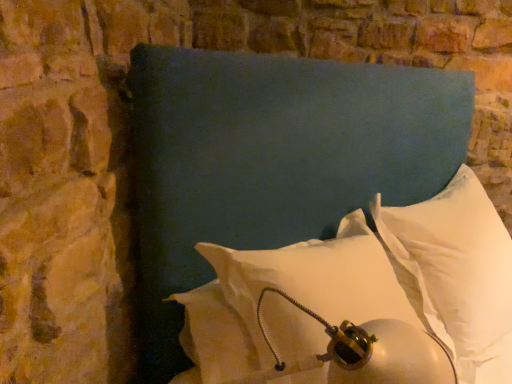
Question: Is the surface of white soft pillow at center, arranged as the 3th pillow when viewed from the left, in direct contact with white soft pillow at center, arranged as the 2th pillow when viewed from the left?

Choices:
 (A) yes
 (B) no

Answer: (B)

Question: Considering the relative positions of white soft pillow at center, arranged as the 3th pillow when viewed from the left, and white soft pillow at center, the second pillow from the right, in the image provided, is white soft pillow at center, arranged as the 3th pillow when viewed from the left, to the right of white soft pillow at center, the second pillow from the right, from the viewer's perspective?

Choices:
 (A) no
 (B) yes

Answer: (B)

Question: Considering the relative sizes of white soft pillow at center, arranged as the 3th pillow when viewed from the left, and white soft pillow at center, the second pillow from the right, in the image provided, is white soft pillow at center, arranged as the 3th pillow when viewed from the left, wider than white soft pillow at center, the second pillow from the right,?

Choices:
 (A) no
 (B) yes

Answer: (A)

Question: From a real-world perspective, is white soft pillow at center, arranged as the 3th pillow when viewed from the left, positioned over white soft pillow at center, arranged as the 2th pillow when viewed from the left, based on gravity?

Choices:
 (A) no
 (B) yes

Answer: (A)

Question: Is white soft pillow at center, arranged as the 3th pillow when viewed from the left, closer to camera compared to white soft pillow at center, the second pillow from the right?

Choices:
 (A) yes
 (B) no

Answer: (B)

Question: Is white soft pillow at center, which is the 1th pillow in right-to-left order, taller or shorter than white soft pillow at lower right, the 3th pillow from the right?

Choices:
 (A) short
 (B) tall

Answer: (A)

Question: From a real-world perspective, is white soft pillow at center, which is the 1th pillow in right-to-left order, positioned above or below white soft pillow at lower right, the 3th pillow from the right?

Choices:
 (A) below
 (B) above

Answer: (B)

Question: Looking at the image, does white soft pillow at center, arranged as the 3th pillow when viewed from the left, seem bigger or smaller compared to white soft pillow at lower right, placed as the first pillow when sorted from left to right?

Choices:
 (A) small
 (B) big

Answer: (A)

Question: From the image's perspective, relative to white soft pillow at lower right, the 3th pillow from the right, is white soft pillow at center, which is the 1th pillow in right-to-left order, above or below?

Choices:
 (A) above
 (B) below

Answer: (A)

Question: From the image's perspective, is white soft pillow at center, the second pillow from the right, located above or below white soft pillow at center, arranged as the 3th pillow when viewed from the left?

Choices:
 (A) above
 (B) below

Answer: (B)

Question: Is white soft pillow at center, the second pillow from the right, wider or thinner than white soft pillow at center, which is the 1th pillow in right-to-left order?

Choices:
 (A) thin
 (B) wide

Answer: (B)

Question: Is white soft pillow at center, the second pillow from the right, inside the boundaries of white soft pillow at center, arranged as the 3th pillow when viewed from the left, or outside?

Choices:
 (A) outside
 (B) inside

Answer: (A)

Question: Considering the relative positions of white soft pillow at center, the second pillow from the right, and white soft pillow at center, which is the 1th pillow in right-to-left order, in the image provided, is white soft pillow at center, the second pillow from the right, to the left or to the right of white soft pillow at center, which is the 1th pillow in right-to-left order,?

Choices:
 (A) left
 (B) right

Answer: (A)

Question: In terms of size, does white soft pillow at center, the second pillow from the right, appear bigger or smaller than white soft pillow at lower right, the 3th pillow from the right?

Choices:
 (A) big
 (B) small

Answer: (A)

Question: Does point (148, 107) appear closer or farther from the camera than point (266, 294)?

Choices:
 (A) farther
 (B) closer

Answer: (A)